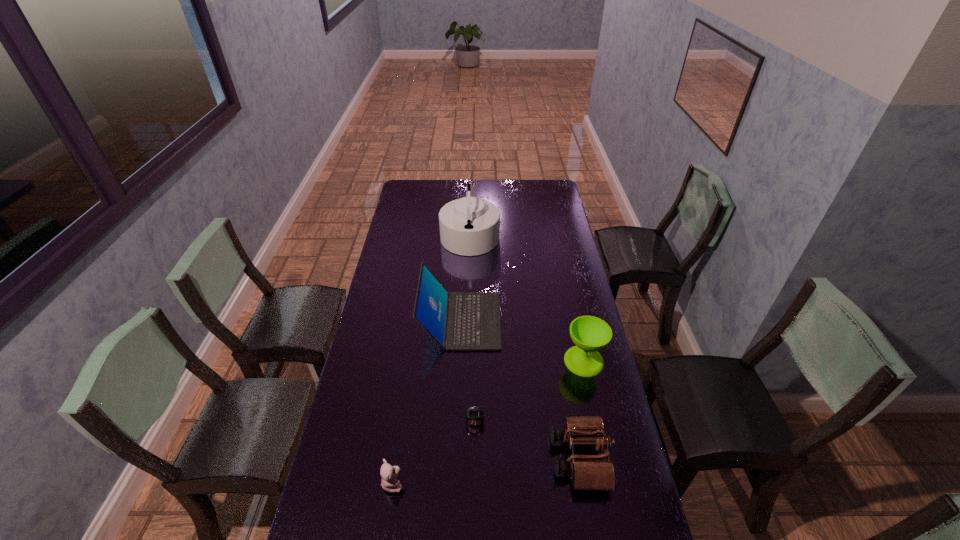
Locate an element on the screen. free space at the right edge is located at coordinates (556, 282).

You are a GUI agent. You are given a task and a screenshot of the screen. Output one action in this format:
    pyautogui.click(x=<x>, y=<y>)
    Task: Click on the vacant space at the far left corner of the desktop
    This screenshot has width=960, height=540.
    Given the screenshot: What is the action you would take?
    pyautogui.click(x=405, y=181)

What are the coordinates of `free spot between the laptop computer and the wineglass` in the screenshot? It's located at (522, 341).

This screenshot has height=540, width=960. What are the coordinates of `vacant space in between the laptop computer and the wineglass` in the screenshot? It's located at (522, 341).

Identify the location of vacant area that lies between the laptop computer and the teddy bear. (427, 402).

Identify the location of vacant space that is in between the teddy bear and the laptop computer. The image size is (960, 540). (427, 402).

Where is `vacant area between the wineglass and the shortest object`? vacant area between the wineglass and the shortest object is located at coordinates (529, 392).

Find the location of a particular element. free space between the teddy bear and the wineglass is located at coordinates (489, 422).

Image resolution: width=960 pixels, height=540 pixels. What are the coordinates of `free spot between the laptop computer and the binoculars` in the screenshot? It's located at (520, 389).

Locate an element on the screen. This screenshot has width=960, height=540. unoccupied position between the binoculars and the teddy bear is located at coordinates (487, 470).